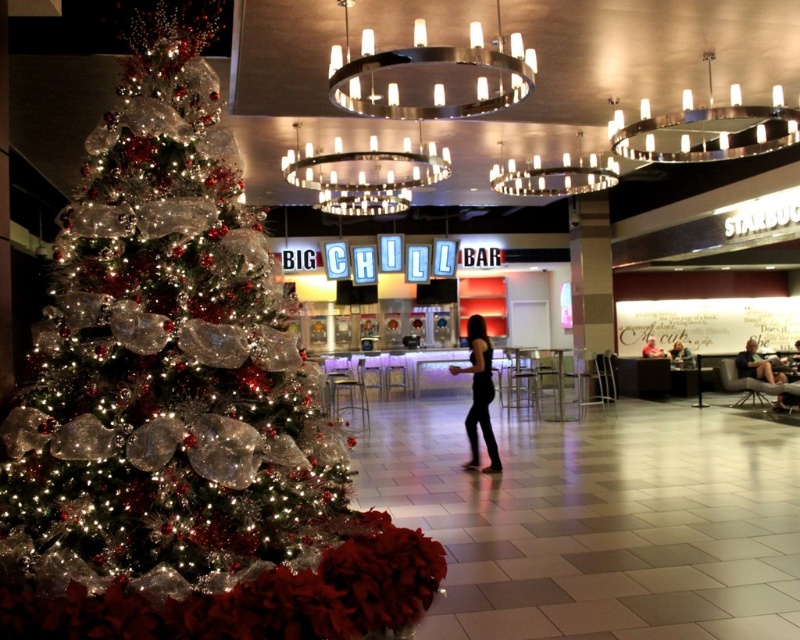
Who is more distant from viewer, (364, 150) or (686, 365)?

The point (686, 365) is more distant.

Can you confirm if metallic ring chandelier at center is shorter than dark blue shirt at lower right?

In fact, metallic ring chandelier at center may be taller than dark blue shirt at lower right.

I want to click on metallic ring chandelier at center, so click(366, 176).

Between metallic ring chandelier at center and black matte dress at center, which one appears on the left side from the viewer's perspective?

From the viewer's perspective, metallic ring chandelier at center appears more on the left side.

Does metallic ring chandelier at center appear on the right side of black matte dress at center?

In fact, metallic ring chandelier at center is to the left of black matte dress at center.

Is point (432, 156) in front of point (488, 371)?

No, it is not.

Locate an element on the screen. Image resolution: width=800 pixels, height=640 pixels. metallic ring chandelier at center is located at coordinates (366, 176).

Does point (772, 378) lie in front of point (650, 339)?

Yes, it is.

Is matte black dress at lower right to the right of black leather chair at center from the viewer's perspective?

Indeed, matte black dress at lower right is positioned on the right side of black leather chair at center.

Is point (754, 362) positioned behind point (649, 355)?

No, it is in front of (649, 355).

Where is `matte black dress at lower right`? Image resolution: width=800 pixels, height=640 pixels. matte black dress at lower right is located at coordinates (756, 364).